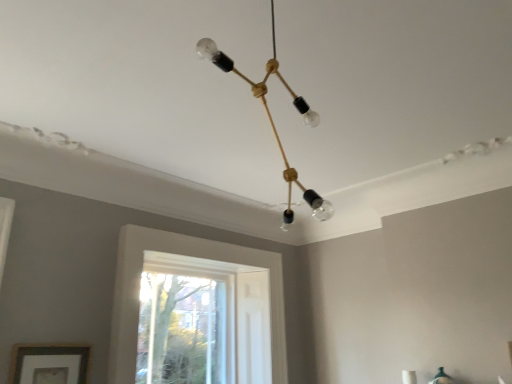
Where is `wooden picture frame at lower left`? The height and width of the screenshot is (384, 512). wooden picture frame at lower left is located at coordinates (49, 364).

Measure the distance between point (302, 108) and camera.

The depth of point (302, 108) is 4.92 feet.

I want to click on wooden picture frame at lower left, so click(49, 364).

Would you say wooden picture frame at lower left is inside or outside clear glass bulb at center?

The correct answer is: outside.

Considering the relative positions of wooden picture frame at lower left and clear glass bulb at center in the image provided, is wooden picture frame at lower left behind clear glass bulb at center?

That is True.

Measure the distance between wooden picture frame at lower left and clear glass bulb at center.

6.00 feet.

Is the depth of clear glass window at center greater than that of clear glass bulb at center?

Yes.

Consider the image. Considering the sizes of objects clear glass window at center and clear glass bulb at center in the image provided, who is wider, clear glass window at center or clear glass bulb at center?

Wider between the two is clear glass bulb at center.

In the scene shown: Is clear glass window at center not near clear glass bulb at center?

Yes, clear glass window at center and clear glass bulb at center are quite far apart.

In the image, there is a clear glass bulb at center. Where is `window below it (from a real-world perspective)`? The height and width of the screenshot is (384, 512). window below it (from a real-world perspective) is located at coordinates (181, 330).

Looking at their sizes, would you say wooden picture frame at lower left is wider or thinner than clear glass window at center?

wooden picture frame at lower left is thinner than clear glass window at center.

Considering the positions of objects wooden picture frame at lower left and clear glass window at center in the image provided, who is more to the right, wooden picture frame at lower left or clear glass window at center?

From the viewer's perspective, clear glass window at center appears more on the right side.

Is wooden picture frame at lower left closer to the viewer compared to clear glass window at center?

Yes, it is in front of clear glass window at center.

Could you tell me if wooden picture frame at lower left is turned towards clear glass window at center?

No, wooden picture frame at lower left is not facing towards clear glass window at center.

Which object is closer to the camera taking this photo, clear glass bulb at center or clear glass window at center?

clear glass bulb at center.

In the scene shown: From the image's perspective, is clear glass bulb at center under clear glass window at center?

Actually, clear glass bulb at center appears above clear glass window at center in the image.

Who is smaller, clear glass bulb at center or clear glass window at center?

clear glass window at center.

Based on the photo, between clear glass window at center and wooden picture frame at lower left, which one has smaller size?

wooden picture frame at lower left is smaller.

Relative to wooden picture frame at lower left, is clear glass window at center in front or behind?

Visually, clear glass window at center is located behind wooden picture frame at lower left.

Does clear glass window at center have a greater height compared to wooden picture frame at lower left?

Yes, clear glass window at center is taller than wooden picture frame at lower left.

Which is closer to the camera, [198,326] or [41,370]?

Point [41,370]

Is clear glass bulb at center oriented away from wooden picture frame at lower left?

clear glass bulb at center does not have its back to wooden picture frame at lower left.

From the image's perspective, is clear glass bulb at center located above wooden picture frame at lower left?

Yes, from the image's perspective, clear glass bulb at center is on top of wooden picture frame at lower left.

Is point (287, 218) farther from camera compared to point (39, 348)?

That is False.

At what (x,y) coordinates should I click in order to perform the action: click on lamp on the right of wooden picture frame at lower left. Please return your answer as a coordinate pair (x, y). Looking at the image, I should click on (273, 122).

Find the location of a particular element. The width and height of the screenshot is (512, 384). lamp that appears above the clear glass window at center (from the image's perspective) is located at coordinates (273, 122).

Estimate the real-world distances between objects in this image. Which object is closer to clear glass window at center, clear glass bulb at center or wooden picture frame at lower left?

Based on the image, wooden picture frame at lower left appears to be nearer to clear glass window at center.

Considering their positions, is clear glass bulb at center positioned closer to wooden picture frame at lower left than clear glass window at center?

clear glass window at center.

Considering their positions, is clear glass window at center positioned further to wooden picture frame at lower left than clear glass bulb at center?

Based on the image, clear glass bulb at center appears to be further to wooden picture frame at lower left.

Based on their spatial positions, is wooden picture frame at lower left or clear glass window at center further from clear glass bulb at center?

Based on the image, clear glass window at center appears to be further to clear glass bulb at center.

From the image, which object appears to be nearer to clear glass window at center, wooden picture frame at lower left or clear glass bulb at center?

Based on the image, wooden picture frame at lower left appears to be nearer to clear glass window at center.

Considering their positions, is clear glass window at center positioned further to clear glass bulb at center than wooden picture frame at lower left?

clear glass window at center is further to clear glass bulb at center.

The height and width of the screenshot is (384, 512). I want to click on picture frame located between clear glass bulb at center and clear glass window at center in the depth direction, so (49, 364).